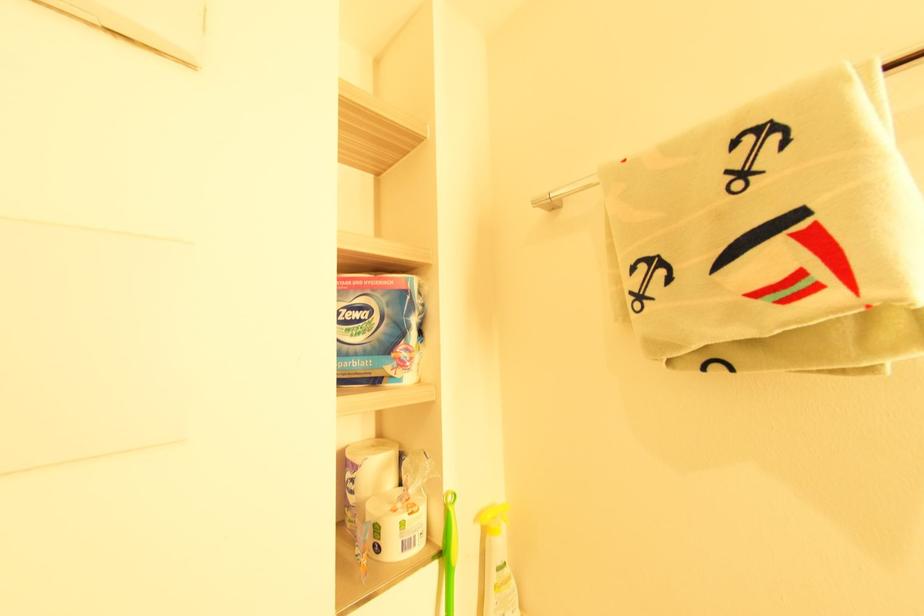
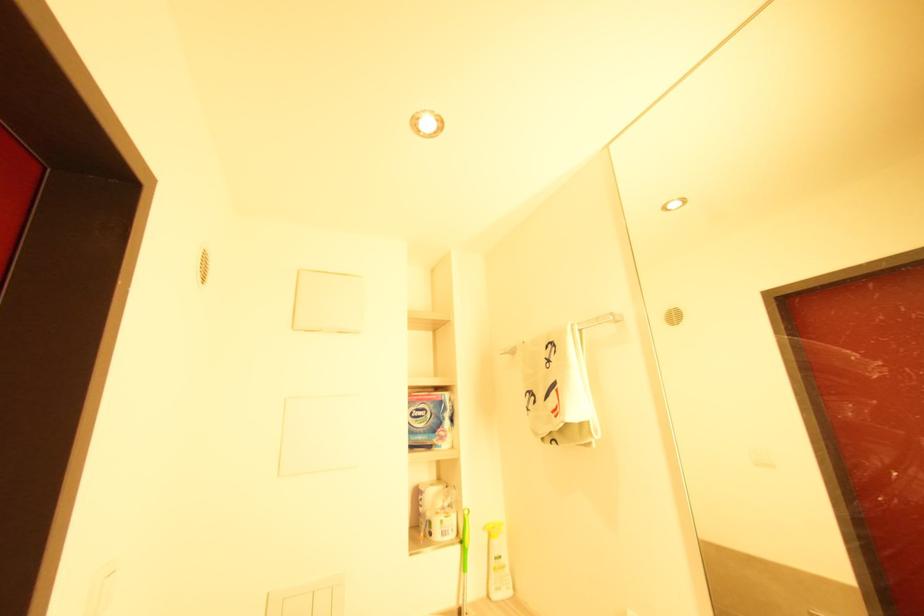
The images are taken continuously from a first-person perspective. In which direction are you moving?

The movement direction of the cameraman is right, backward.